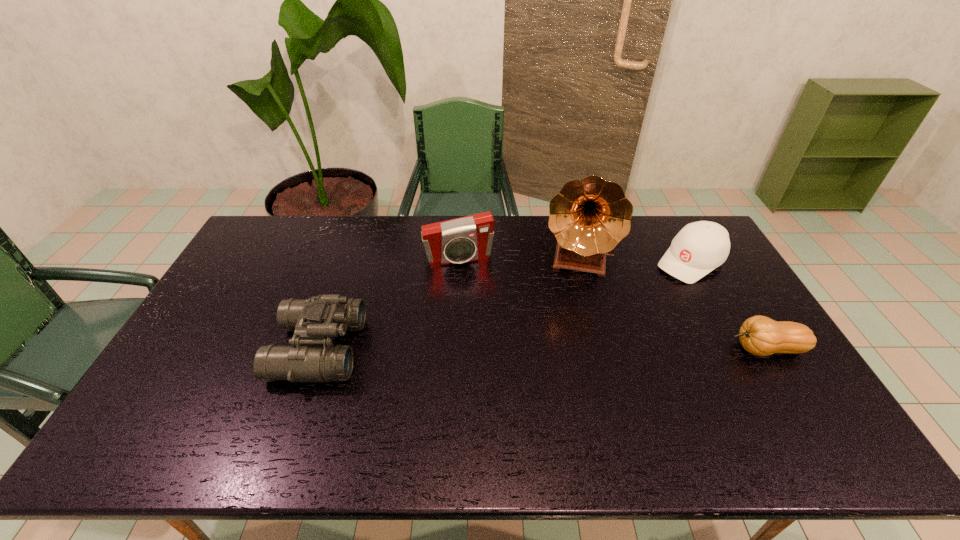
Where is `vacant space on the desktop that is between the binoculars and the gourd and is positioned on the horn of the phonograph_record`? The width and height of the screenshot is (960, 540). vacant space on the desktop that is between the binoculars and the gourd and is positioned on the horn of the phonograph_record is located at coordinates (564, 349).

Where is `vacant space on the desktop that is between the leftmost object and the shortest object and is positioned on the front-facing side of the baseball cap`? vacant space on the desktop that is between the leftmost object and the shortest object and is positioned on the front-facing side of the baseball cap is located at coordinates (571, 349).

The height and width of the screenshot is (540, 960). In order to click on free space on the desktop that is between the binoculars and the shortest object and is positioned on the front-facing side of the camera in this screenshot , I will do `click(480, 349)`.